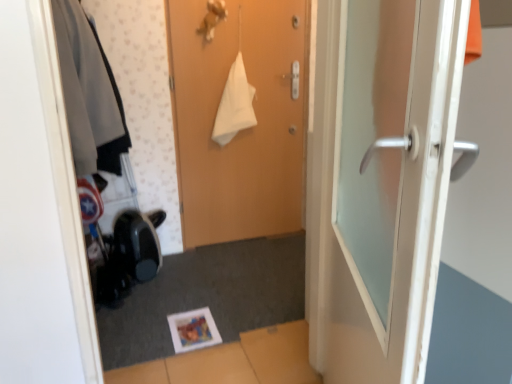
Question: Should I look upward or downward to see wooden door at center, the first door in the back-to-front sequence?

Choices:
 (A) up
 (B) down

Answer: (A)

Question: Can you confirm if matte gray jacket at left is positioned to the right of wooden door at center, the first door in the back-to-front sequence?

Choices:
 (A) no
 (B) yes

Answer: (A)

Question: Does matte gray jacket at left turn towards wooden door at center, the first door in the back-to-front sequence?

Choices:
 (A) no
 (B) yes

Answer: (A)

Question: From the image's perspective, is matte gray jacket at left on wooden door at center, the first door in the back-to-front sequence?

Choices:
 (A) yes
 (B) no

Answer: (A)

Question: Does matte gray jacket at left touch wooden door at center, the first door in the back-to-front sequence?

Choices:
 (A) no
 (B) yes

Answer: (A)

Question: Are matte gray jacket at left and wooden door at center, the first door in the back-to-front sequence, located far from each other?

Choices:
 (A) no
 (B) yes

Answer: (A)

Question: Could wooden door at center, the first door in the back-to-front sequence, be considered to be inside matte gray jacket at left?

Choices:
 (A) no
 (B) yes

Answer: (A)

Question: Would you say wooden door at center, the first door in the back-to-front sequence, contains white glossy door at right, arranged as the second door when viewed from the back?

Choices:
 (A) no
 (B) yes

Answer: (A)

Question: Is wooden door at center, the first door in the back-to-front sequence, in contact with white glossy door at right, arranged as the second door when viewed from the back?

Choices:
 (A) no
 (B) yes

Answer: (A)

Question: From a real-world perspective, is wooden door at center, the first door in the back-to-front sequence, located higher than white glossy door at right, the first door in the front-to-back sequence?

Choices:
 (A) yes
 (B) no

Answer: (A)

Question: Does wooden door at center, the first door in the back-to-front sequence, have a lesser width compared to white glossy door at right, the first door in the front-to-back sequence?

Choices:
 (A) no
 (B) yes

Answer: (B)

Question: From a real-world perspective, is wooden door at center, the first door in the back-to-front sequence, physically below white glossy door at right, the first door in the front-to-back sequence?

Choices:
 (A) no
 (B) yes

Answer: (A)

Question: Can you confirm if wooden door at center, which is counted as the 2th door, starting from the front, is wider than white glossy door at right, the first door in the front-to-back sequence?

Choices:
 (A) yes
 (B) no

Answer: (B)

Question: From a real-world perspective, is wooden door at center, which is counted as the 2th door, starting from the front, below matte gray jacket at left?

Choices:
 (A) yes
 (B) no

Answer: (A)